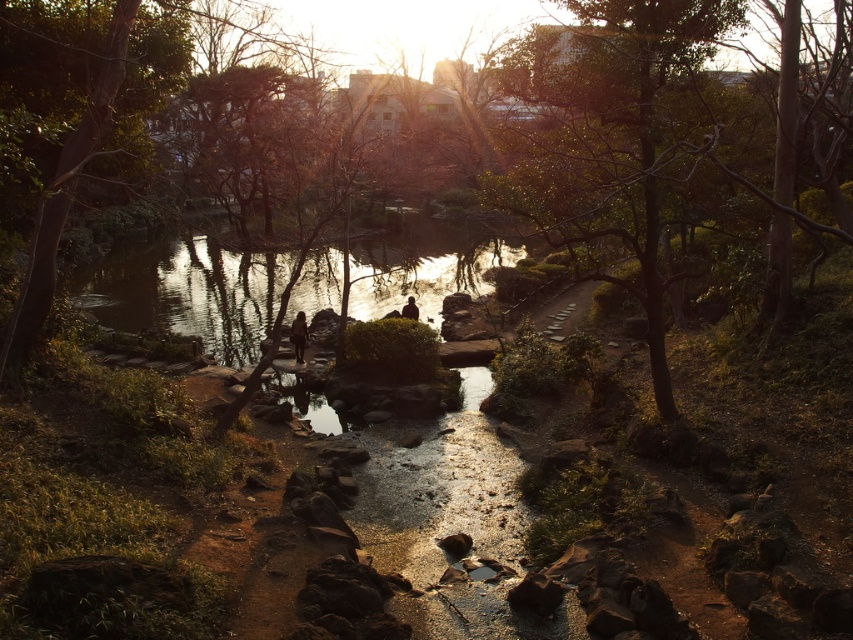
Is green leafy tree at upper center wider than silhouette figure at center?

Indeed, green leafy tree at upper center has a greater width compared to silhouette figure at center.

Is green leafy tree at upper center positioned before silhouette figure at center?

Yes, it is.

This screenshot has height=640, width=853. In order to click on green leafy tree at upper center in this screenshot , I will do `click(611, 141)`.

The image size is (853, 640). What are the coordinates of `green leafy tree at upper center` in the screenshot? It's located at 611,141.

Is green leafy tree at upper center to the right of brown textured rock at center from the viewer's perspective?

Correct, you'll find green leafy tree at upper center to the right of brown textured rock at center.

Does green leafy tree at upper center have a greater height compared to brown textured rock at center?

Yes.

Which is behind, point (564, 212) or point (306, 342)?

The point (306, 342) is more distant.

Find the location of a particular element. This screenshot has width=853, height=640. green leafy tree at upper center is located at coordinates (611, 141).

How far apart are brown textured rock at center and silhouette figure at center?

brown textured rock at center and silhouette figure at center are 3.45 meters apart from each other.

Is brown textured rock at center smaller than silhouette figure at center?

No, brown textured rock at center is not smaller than silhouette figure at center.

Does point (305, 314) come farther from viewer compared to point (405, 314)?

No.

Where is `brown textured rock at center`? brown textured rock at center is located at coordinates click(299, 336).